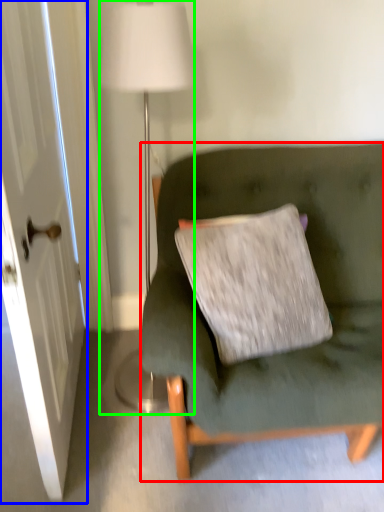
Question: Which object is the farthest from studio couch (highlighted by a red box)? Choose among these: door (highlighted by a blue box) or lamp (highlighted by a green box).

Choices:
 (A) door
 (B) lamp

Answer: (B)